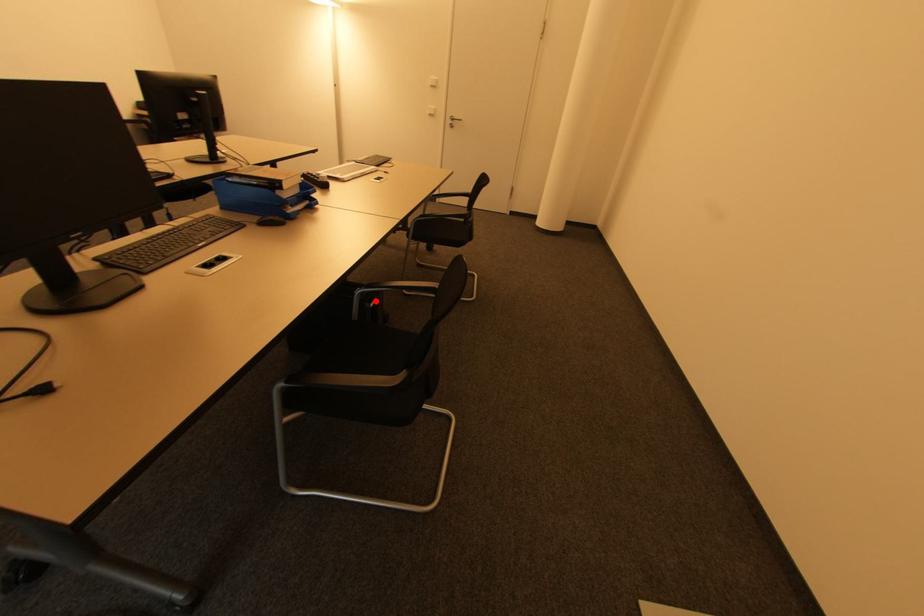
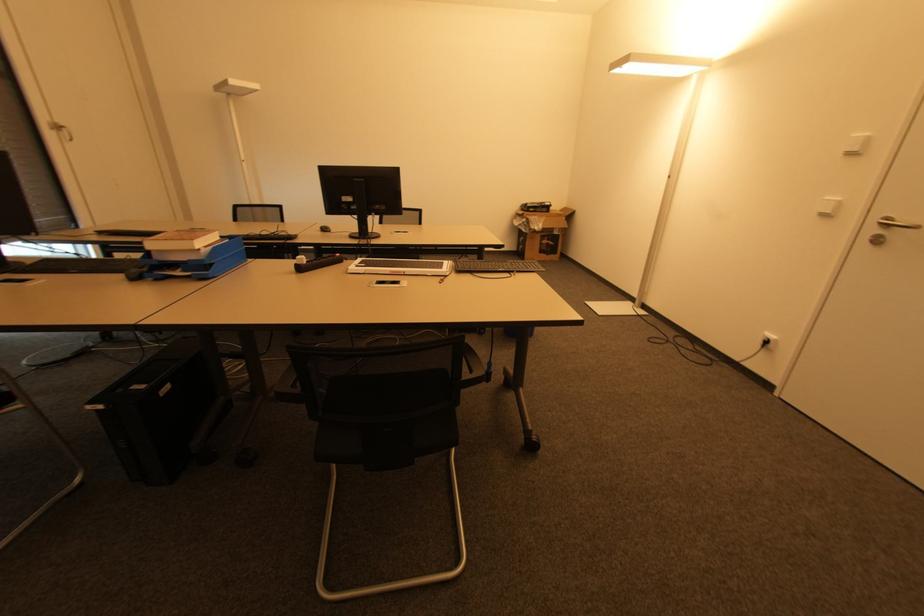
Question: I am providing you with two images of the same scene from different viewpoints. In image1, a red point is highlighted. Considering the same 3D point in image2, which of the following is correct?

Choices:
 (A) It is closer
 (B) It is farther

Answer: (B)